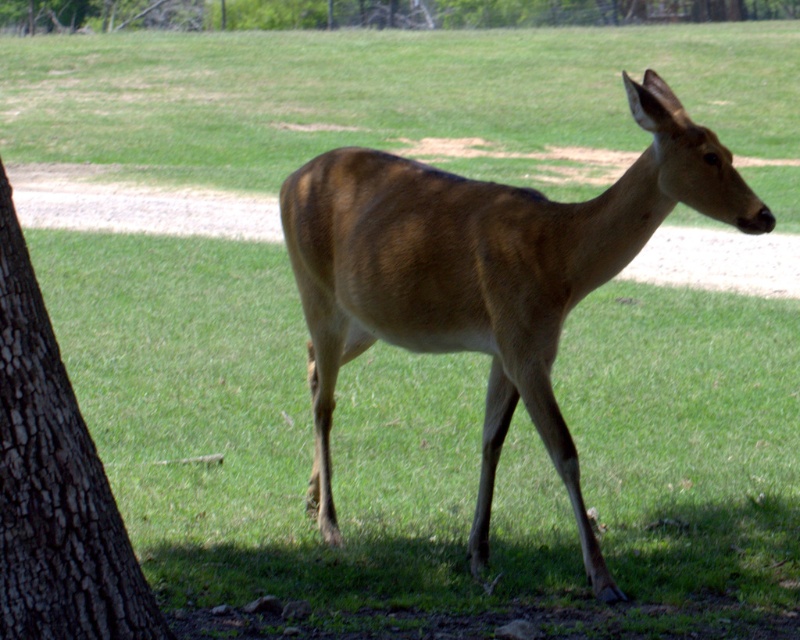
Question: Can you confirm if brown matte/deer at center is positioned to the right of brown rough bark at upper center?

Choices:
 (A) no
 (B) yes

Answer: (B)

Question: Can you confirm if brown matte/deer at center is positioned above dark brown bark at left?

Choices:
 (A) no
 (B) yes

Answer: (B)

Question: Which object is the closest to the brown matte/deer at center?

Choices:
 (A) dark brown bark at left
 (B) brown rough bark at upper center

Answer: (A)

Question: Which object is positioned farthest from the brown matte/deer at center?

Choices:
 (A) brown rough bark at upper center
 (B) dark brown bark at left

Answer: (A)

Question: Is brown matte/deer at center positioned at the back of dark brown bark at left?

Choices:
 (A) no
 (B) yes

Answer: (B)

Question: Which object is the farthest from the dark brown bark at left?

Choices:
 (A) brown rough bark at upper center
 (B) brown matte/deer at center

Answer: (A)